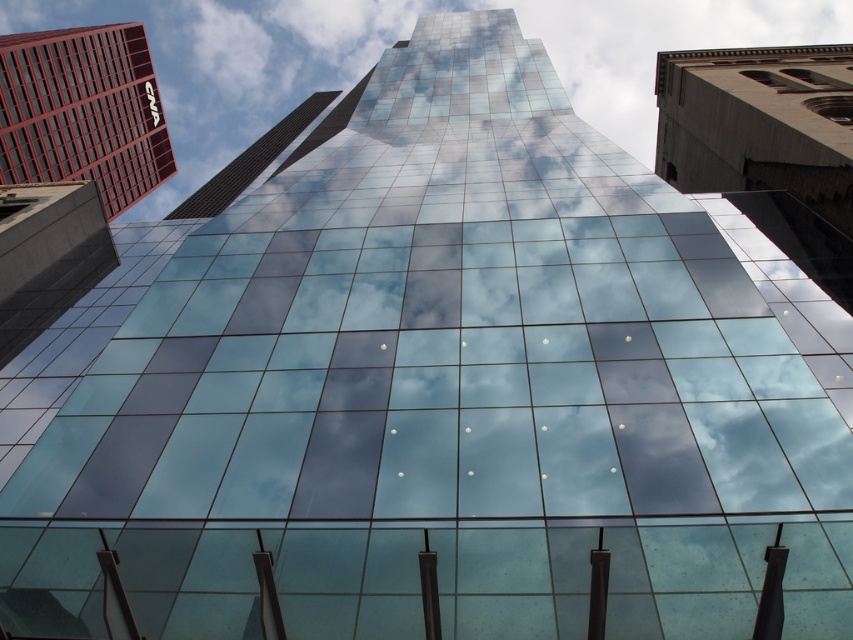
Is transparent glass skyscraper at center bigger than matte red building at upper left?

Yes.

Does point (222, 132) come farther from viewer compared to point (91, 48)?

Yes, point (222, 132) is behind point (91, 48).

Who is more forward, (x=199, y=150) or (x=106, y=140)?

Point (x=106, y=140)

The image size is (853, 640). Find the location of `transparent glass skyscraper at center`. transparent glass skyscraper at center is located at coordinates (389, 45).